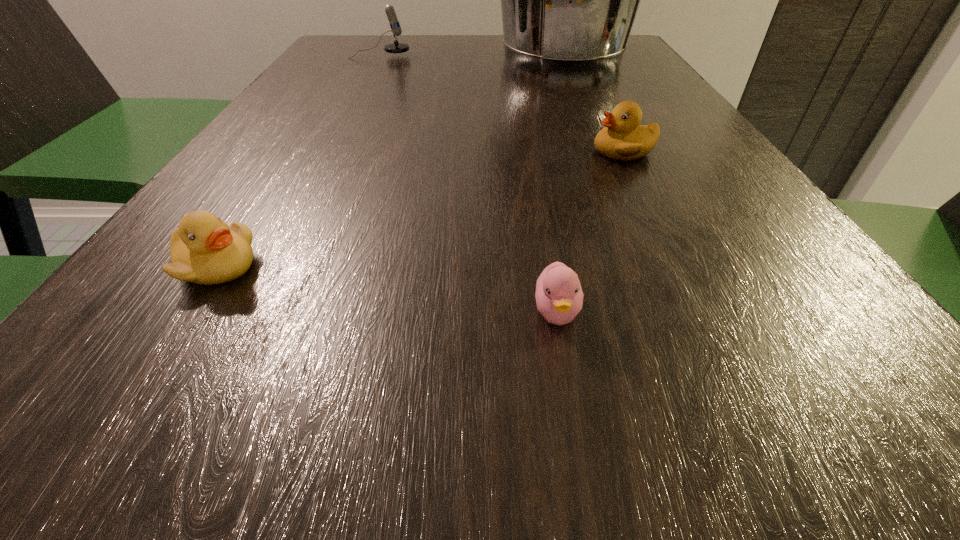
The height and width of the screenshot is (540, 960). What are the coordinates of `object that is at the far right corner` in the screenshot? It's located at (569, 0).

Locate an element on the screen. free space at the far edge of the desktop is located at coordinates (400, 39).

In order to click on vacant position at the near edge of the desktop in this screenshot , I will do point(478,485).

You are a GUI agent. You are given a task and a screenshot of the screen. Output one action in this format:
    pyautogui.click(x=<x>, y=<y>)
    Task: Click on the vacant position at the left edge of the desktop
    The image size is (960, 540).
    Given the screenshot: What is the action you would take?
    pyautogui.click(x=242, y=184)

The height and width of the screenshot is (540, 960). I want to click on free point at the right edge, so click(x=852, y=317).

Identify the location of free location at the far left corner of the desktop. The image size is (960, 540). (381, 48).

Find the location of `empty location between the bucket and the microphone`. empty location between the bucket and the microphone is located at coordinates (471, 57).

The image size is (960, 540). I want to click on vacant area that lies between the farthest duckling and the second duckling from left to right, so click(590, 232).

Find the location of a particular element. vacant space in between the farthest duckling and the leftmost duckling is located at coordinates (420, 209).

Locate an element on the screen. unoccupied position between the farthest duckling and the tallest object is located at coordinates (593, 105).